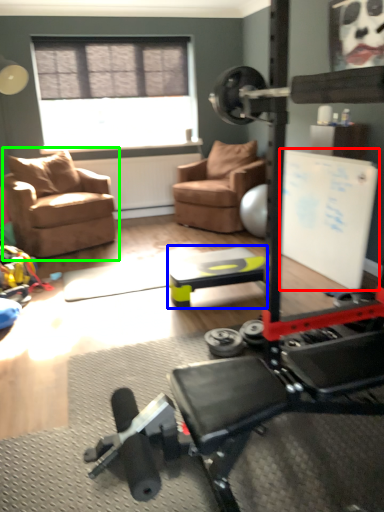
Question: Which is nearer to the bulletin board (highlighted by a red box)? table (highlighted by a blue box) or chair (highlighted by a green box).

Choices:
 (A) table
 (B) chair

Answer: (A)